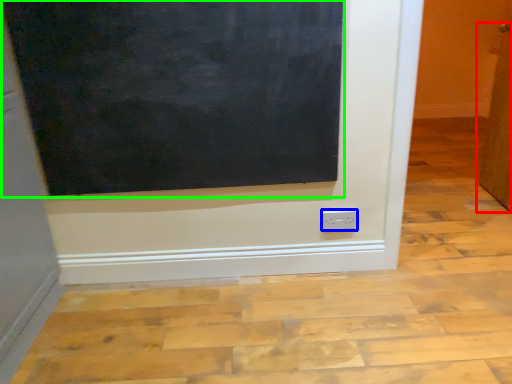
Question: Considering the real-world distances, which object is farthest from door (highlighted by a red box)? power plugs and sockets (highlighted by a blue box) or bulletin board (highlighted by a green box)?

Choices:
 (A) power plugs and sockets
 (B) bulletin board

Answer: (B)